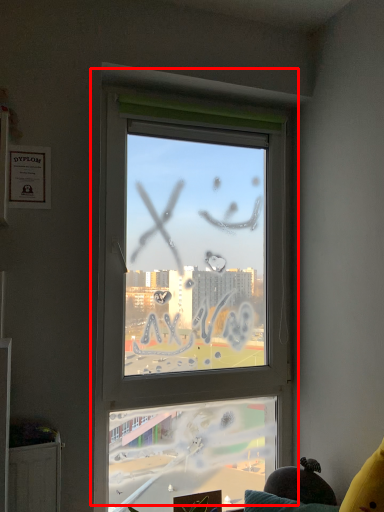
Question: From the image, what is the correct spatial relationship of window (annotated by the red box) in relation to couch?

Choices:
 (A) right
 (B) left

Answer: (B)